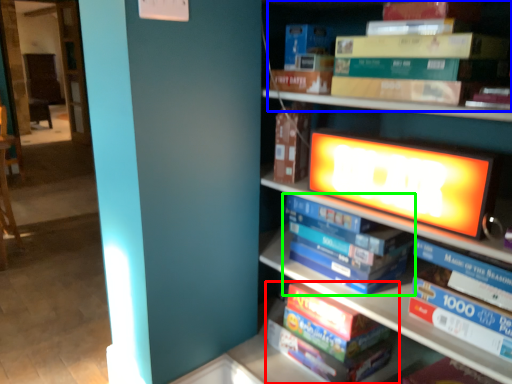
Question: Which is farther away from book (highlighted by a red box)? book (highlighted by a blue box) or book (highlighted by a green box)?

Choices:
 (A) book
 (B) book

Answer: (A)